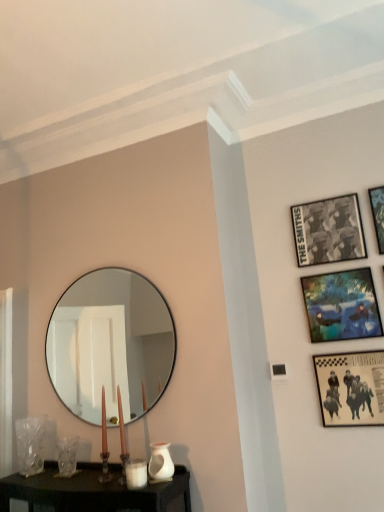
Question: Does white matte candle holder at lower center have a greater width compared to clear glass vase at lower left?

Choices:
 (A) yes
 (B) no

Answer: (B)

Question: From a real-world perspective, is white matte candle holder at lower center under clear glass vase at lower left?

Choices:
 (A) yes
 (B) no

Answer: (A)

Question: Does white matte candle holder at lower center appear on the left side of clear glass vase at lower left?

Choices:
 (A) no
 (B) yes

Answer: (A)

Question: Does white matte candle holder at lower center have a greater height compared to clear glass vase at lower left?

Choices:
 (A) no
 (B) yes

Answer: (A)

Question: From the image's perspective, is white matte candle holder at lower center beneath clear glass vase at lower left?

Choices:
 (A) yes
 (B) no

Answer: (B)

Question: From a real-world perspective, relative to blue fabric painting at upper right, which is the 2th picture frame in bottom-to-top order, is white glossy vase at lower center vertically above or below?

Choices:
 (A) below
 (B) above

Answer: (A)

Question: Considering the positions of white glossy vase at lower center and blue fabric painting at upper right, which is the 2th picture frame in bottom-to-top order, in the image, is white glossy vase at lower center wider or thinner than blue fabric painting at upper right, which is the 2th picture frame in bottom-to-top order,?

Choices:
 (A) wide
 (B) thin

Answer: (A)

Question: Is white glossy vase at lower center situated inside blue fabric painting at upper right, positioned as the third picture frame in top-to-bottom order, or outside?

Choices:
 (A) inside
 (B) outside

Answer: (B)

Question: In the image, is white glossy vase at lower center positioned in front of or behind blue fabric painting at upper right, positioned as the third picture frame in top-to-bottom order?

Choices:
 (A) behind
 (B) front

Answer: (B)

Question: In terms of size, does white matte candle holder at lower center appear bigger or smaller than blue fabric painting at upper right, which is the 2th picture frame in bottom-to-top order?

Choices:
 (A) big
 (B) small

Answer: (B)

Question: Considering their positions, is white matte candle holder at lower center located in front of or behind blue fabric painting at upper right, which is the 2th picture frame in bottom-to-top order?

Choices:
 (A) front
 (B) behind

Answer: (A)

Question: Would you say white matte candle holder at lower center is inside or outside blue fabric painting at upper right, which is the 2th picture frame in bottom-to-top order?

Choices:
 (A) outside
 (B) inside

Answer: (A)

Question: In terms of width, does white matte candle holder at lower center look wider or thinner when compared to blue fabric painting at upper right, which is the 2th picture frame in bottom-to-top order?

Choices:
 (A) wide
 (B) thin

Answer: (A)

Question: Is metallic silver picture frame at upper right, which is the 1th picture frame from top to bottom, inside or outside of blue fabric painting at upper right, positioned as the third picture frame in top-to-bottom order?

Choices:
 (A) outside
 (B) inside

Answer: (A)

Question: Is metallic silver picture frame at upper right, which is the 1th picture frame from top to bottom, in front of or behind blue fabric painting at upper right, positioned as the third picture frame in top-to-bottom order, in the image?

Choices:
 (A) front
 (B) behind

Answer: (A)